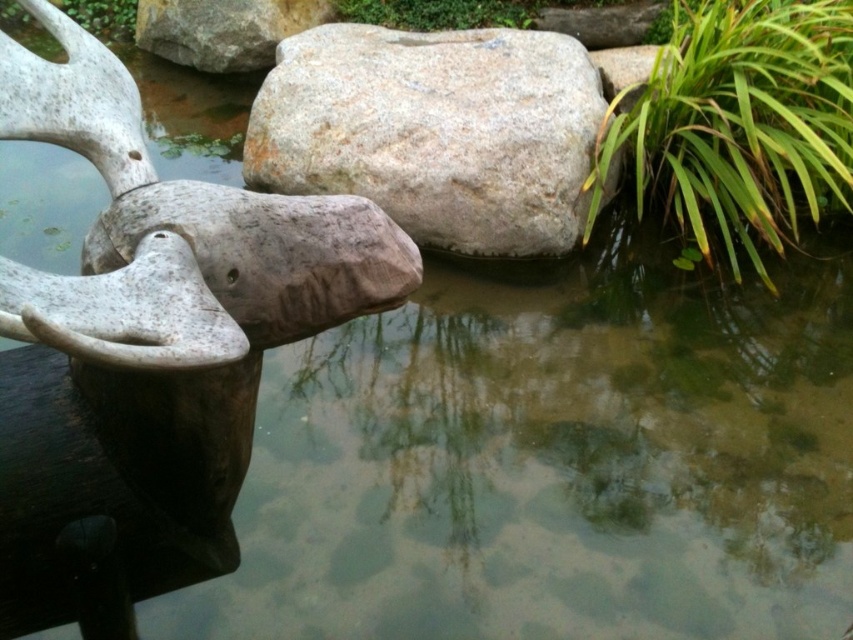
Does white stone sculpture at upper left appear under gray/rough stone at center?

Yes, white stone sculpture at upper left is below gray/rough stone at center.

Identify the location of white stone sculpture at upper left. This screenshot has height=640, width=853. (154, 333).

The image size is (853, 640). In order to click on white stone sculpture at upper left in this screenshot , I will do `click(154, 333)`.

Can you confirm if green leafy plant at right is positioned to the left of green leafy plant at upper center?

No, green leafy plant at right is not to the left of green leafy plant at upper center.

Describe the element at coordinates (741, 122) in the screenshot. The height and width of the screenshot is (640, 853). I see `green leafy plant at right` at that location.

Find the location of `green leafy plant at right`. green leafy plant at right is located at coordinates (741, 122).

Find the location of a particular element. This screenshot has width=853, height=640. green leafy plant at right is located at coordinates (741, 122).

Looking at this image, who is more forward, [630,125] or [170,20]?

Point [630,125] is in front.

Identify the location of green leafy plant at right. This screenshot has width=853, height=640. (741, 122).